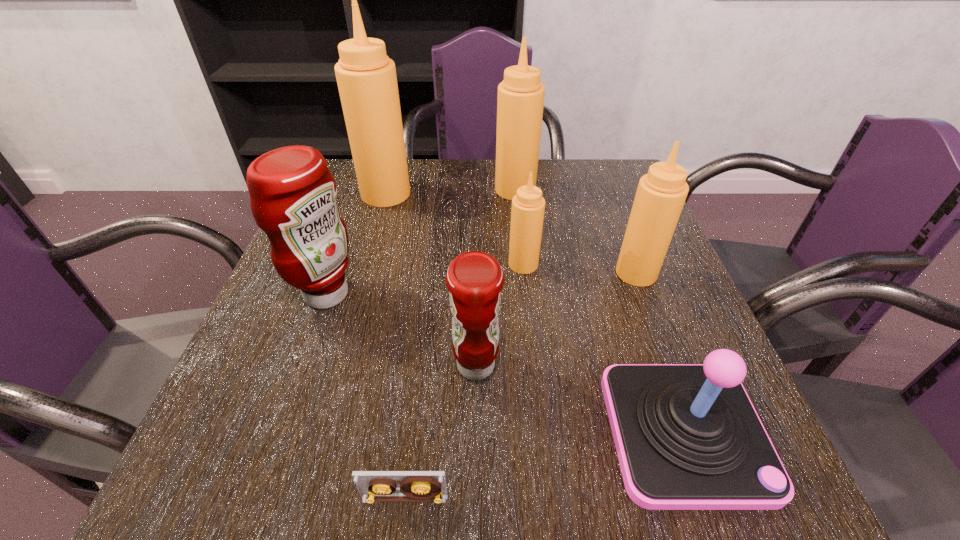
This screenshot has height=540, width=960. Find the location of `vacant area located on the left of the third condiment from left to right`. vacant area located on the left of the third condiment from left to right is located at coordinates (417, 366).

Find the location of a particular element. joystick located at the near edge is located at coordinates (687, 436).

Image resolution: width=960 pixels, height=540 pixels. Find the location of `videotape located at the near edge`. videotape located at the near edge is located at coordinates point(373,486).

At what (x,y) coordinates should I click in order to perform the action: click on condiment that is positioned at the right edge. Please return your answer as a coordinate pair (x, y). This screenshot has width=960, height=540. Looking at the image, I should click on (661, 194).

The height and width of the screenshot is (540, 960). I want to click on joystick located at the right edge, so click(687, 436).

You are a GUI agent. You are given a task and a screenshot of the screen. Output one action in this format:
    pyautogui.click(x=<x>, y=<y>)
    Task: Click on the object that is positioned at the far left corner
    The width and height of the screenshot is (960, 540).
    Given the screenshot: What is the action you would take?
    pyautogui.click(x=366, y=77)

Where is `object at the near right corner`? This screenshot has width=960, height=540. object at the near right corner is located at coordinates (x=687, y=436).

The image size is (960, 540). Identify the location of free region at the far edge. (427, 195).

Image resolution: width=960 pixels, height=540 pixels. What are the coordinates of `vacant space at the left edge of the desktop` in the screenshot? It's located at (370, 212).

Where is `vacant space at the far left corner of the desktop`? This screenshot has width=960, height=540. vacant space at the far left corner of the desktop is located at coordinates (344, 163).